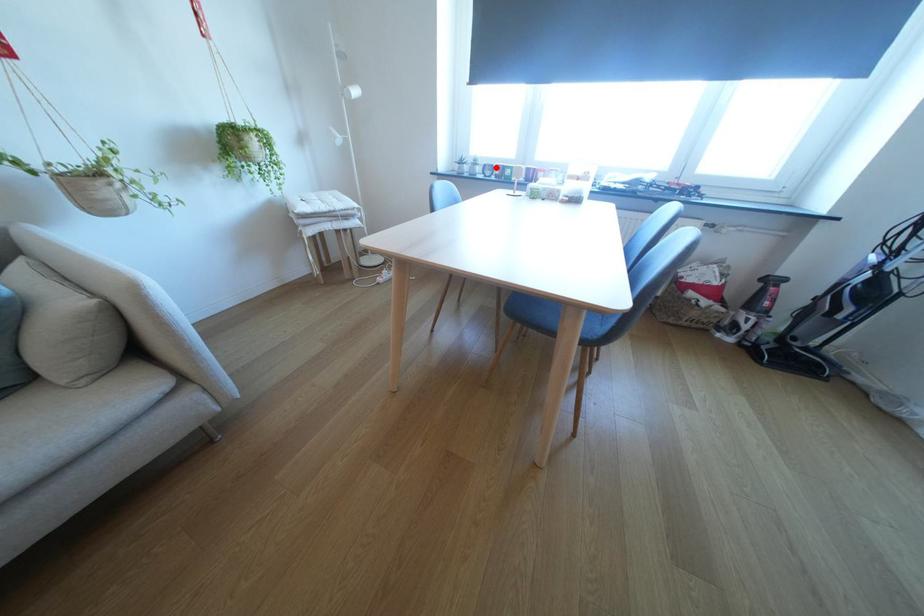
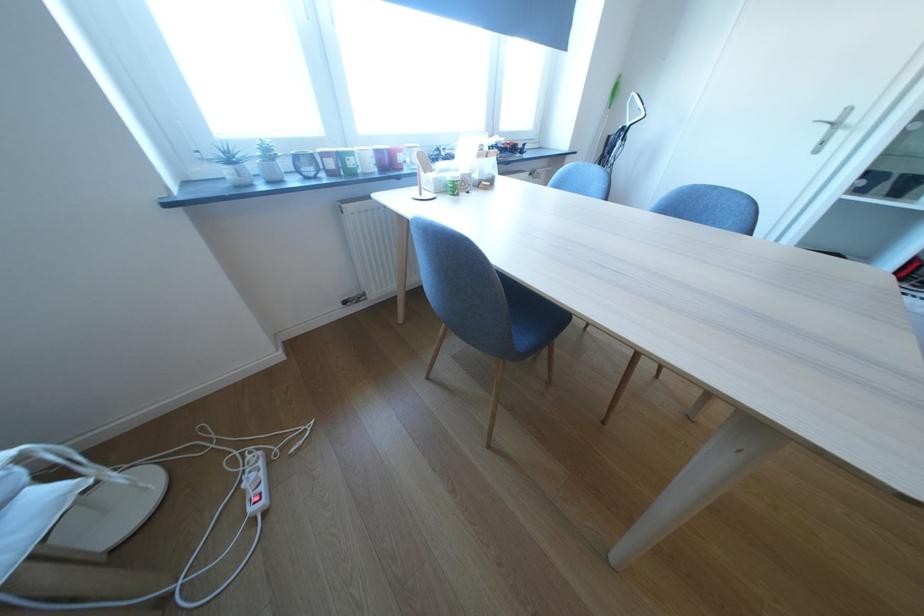
Question: I am providing you with two images of the same scene from different viewpoints. A red point is marked on the first image. At the location where the point appears in image 1, is it still visible in image 2?

Choices:
 (A) Yes
 (B) No

Answer: (A)